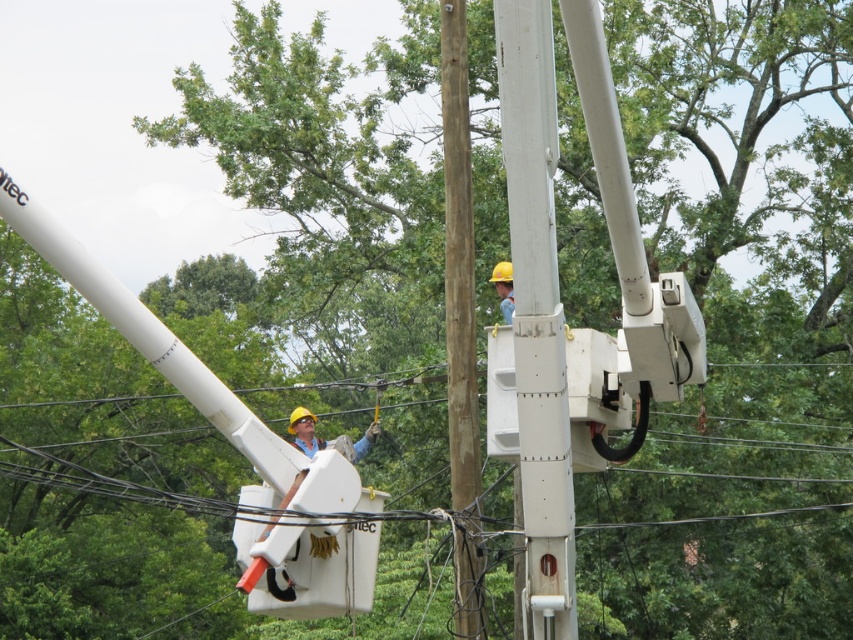
At what (x,y) coordinates should I click in order to perform the action: click on white matte/rough telegraph pole at center. Please return your answer as a coordinate pair (x, y). Image resolution: width=853 pixels, height=640 pixels. Looking at the image, I should click on (537, 314).

Describe the element at coordinates (537, 314) in the screenshot. I see `white matte/rough telegraph pole at center` at that location.

Does point (525, 454) lie in front of point (448, 154)?

Yes.

Image resolution: width=853 pixels, height=640 pixels. Identify the location of white matte/rough telegraph pole at center. (537, 314).

Does point (558, 461) come behind point (497, 272)?

No, (558, 461) is in front of (497, 272).

Is white matte/rough telegraph pole at center to the left of yellow hard hat at upper center from the viewer's perspective?

Indeed, white matte/rough telegraph pole at center is positioned on the left side of yellow hard hat at upper center.

Does point (560, 467) come closer to viewer compared to point (498, 278)?

Yes, it is in front of point (498, 278).

Locate an element on the screen. white matte/rough telegraph pole at center is located at coordinates (537, 314).

Does brown wood telegraph pole at center appear on the right side of yellow hard hat at upper center?

Incorrect, brown wood telegraph pole at center is not on the right side of yellow hard hat at upper center.

Can you confirm if brown wood telegraph pole at center is positioned to the left of yellow hard hat at upper center?

Correct, you'll find brown wood telegraph pole at center to the left of yellow hard hat at upper center.

Is point (456, 636) positioned behind point (511, 288)?

No, (456, 636) is in front of (511, 288).

This screenshot has width=853, height=640. I want to click on brown wood telegraph pole at center, so click(x=460, y=324).